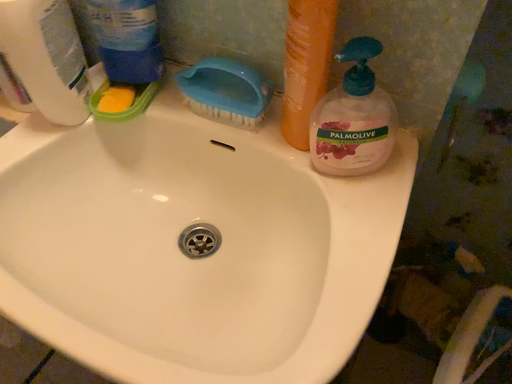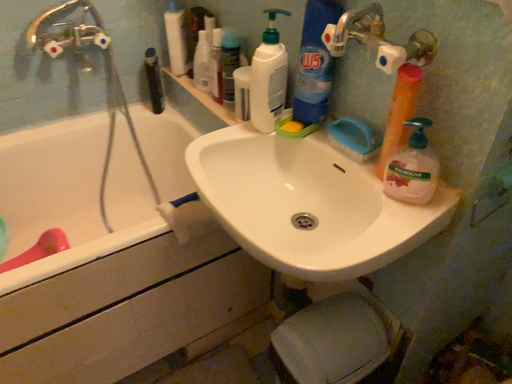
Question: How did the camera likely rotate when shooting the video?

Choices:
 (A) rotated upward
 (B) rotated downward

Answer: (A)